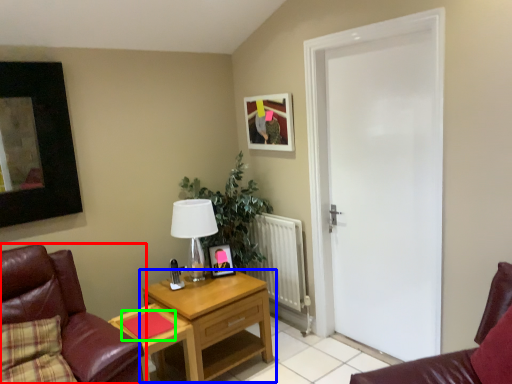
Question: Which object is the farthest from chair (highlighted by a red box)? Choose among these: nightstand (highlighted by a blue box) or pad (highlighted by a green box).

Choices:
 (A) nightstand
 (B) pad

Answer: (A)